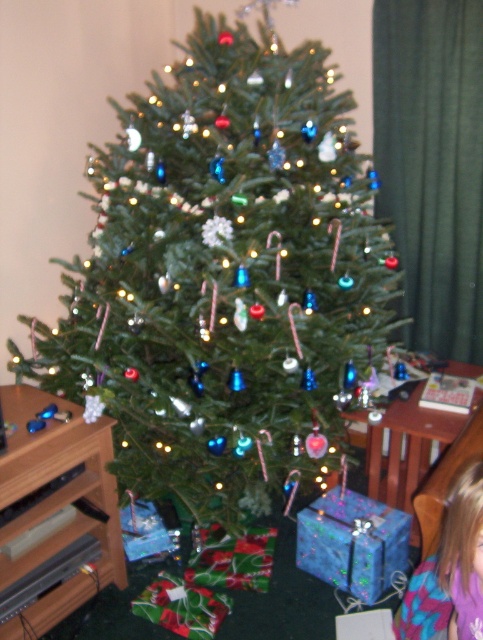
Question: Which of the following is the closest to the observer?

Choices:
 (A) (448, 536)
 (B) (238, 60)

Answer: (A)

Question: Which object appears farthest from the camera in this image?

Choices:
 (A) blonde hair at lower right
 (B) green matte christmas tree at center

Answer: (B)

Question: Is green matte christmas tree at center positioned before blonde hair at lower right?

Choices:
 (A) no
 (B) yes

Answer: (A)

Question: Can you confirm if green matte christmas tree at center is positioned above blonde hair at lower right?

Choices:
 (A) yes
 (B) no

Answer: (A)

Question: Does green matte christmas tree at center have a larger size compared to blonde hair at lower right?

Choices:
 (A) no
 (B) yes

Answer: (B)